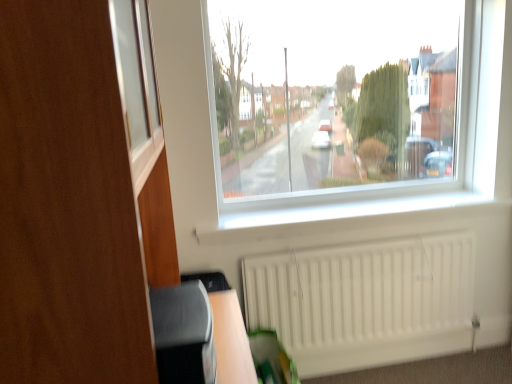
Question: From the image's perspective, relative to matte wood dresser at left, is white matte radiator at lower right above or below?

Choices:
 (A) above
 (B) below

Answer: (B)

Question: Based on their sizes in the image, would you say white matte radiator at lower right is bigger or smaller than matte wood dresser at left?

Choices:
 (A) small
 (B) big

Answer: (A)

Question: Visually, is white matte radiator at lower right positioned to the left or to the right of matte wood dresser at left?

Choices:
 (A) right
 (B) left

Answer: (A)

Question: Relative to white matte radiator at lower right, is matte wood dresser at left in front or behind?

Choices:
 (A) front
 (B) behind

Answer: (A)

Question: From a real-world perspective, is matte wood dresser at left positioned above or below white matte radiator at lower right?

Choices:
 (A) above
 (B) below

Answer: (A)

Question: Is matte wood dresser at left bigger or smaller than white matte radiator at lower right?

Choices:
 (A) small
 (B) big

Answer: (B)

Question: Would you say matte wood dresser at left is inside or outside white matte radiator at lower right?

Choices:
 (A) outside
 (B) inside

Answer: (A)